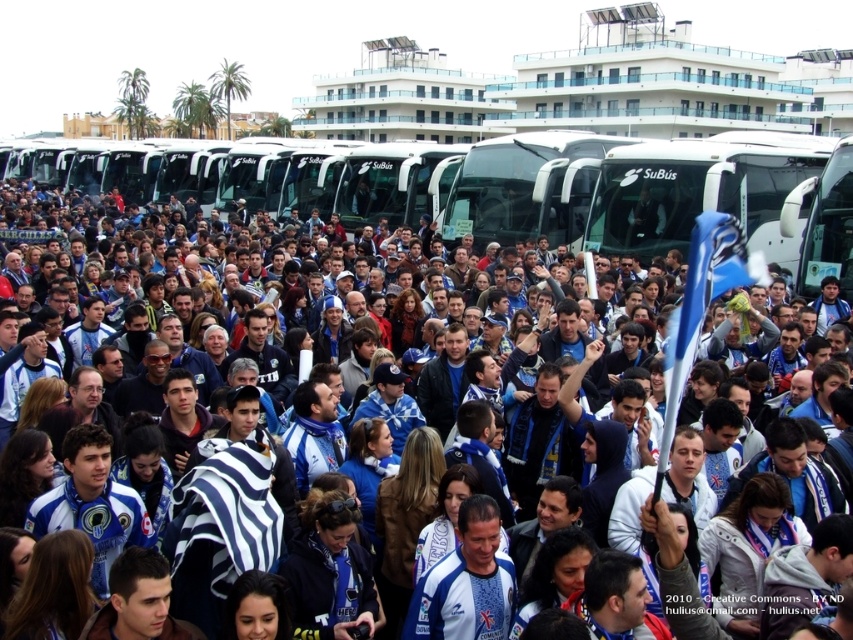
Can you confirm if white jersey at center is thinner than white glossy tour bus at center?

No.

Is white jersey at center wider than white glossy tour bus at center?

Indeed, white jersey at center has a greater width compared to white glossy tour bus at center.

You are a GUI agent. You are given a task and a screenshot of the screen. Output one action in this format:
    pyautogui.click(x=<x>, y=<y>)
    Task: Click on the white jersey at center
    The width and height of the screenshot is (853, 640).
    Given the screenshot: What is the action you would take?
    pyautogui.click(x=123, y=440)